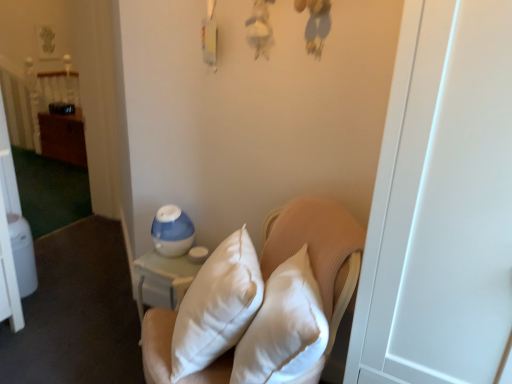
At what (x,y) coordinates should I click in order to perform the action: click on wooden dresser at left. Please return your answer as a coordinate pair (x, y). The width and height of the screenshot is (512, 384). Looking at the image, I should click on (63, 137).

Is there a large distance between wooden bed at left and white quilted pillows at center?

Yes, wooden bed at left and white quilted pillows at center are located far from each other.

Considering the points (71, 150) and (352, 307), which point is behind, point (71, 150) or point (352, 307)?

The point (71, 150) is more distant.

Which of these two, wooden bed at left or white quilted pillows at center, is bigger?

white quilted pillows at center.

From the image's perspective, is wooden bed at left located beneath white quilted pillows at center?

No, from the image's perspective, wooden bed at left is not beneath white quilted pillows at center.

Locate an element on the screen. Image resolution: width=512 pixels, height=384 pixels. bed behind the white quilted pillows at center is located at coordinates (55, 114).

Is white quilted pillows at center facing away from wooden bed at left?

No, white quilted pillows at center's orientation is not away from wooden bed at left.

Is white quilted pillows at center not close to wooden bed at left?

white quilted pillows at center is far away from wooden bed at left.

What are the coordinates of `dresser lying behind the white quilted pillows at center` in the screenshot? It's located at (63, 137).

From the image's perspective, is white quilted pillows at center on top of wooden dresser at left?

No, from the image's perspective, white quilted pillows at center is not on top of wooden dresser at left.

Does white quilted pillows at center have a lesser width compared to wooden dresser at left?

No.

Is white quilted pillows at center facing towards wooden dresser at left?

No, white quilted pillows at center does not turn towards wooden dresser at left.

From a real-world perspective, is wooden dresser at left above or below white quilted pillows at center?

In terms of real-world spatial position, wooden dresser at left is below white quilted pillows at center.

Is point (53, 130) closer or farther from the camera than point (281, 252)?

Point (53, 130) appears to be farther away from the viewer than point (281, 252).

How many degrees apart are the facing directions of wooden dresser at left and white quilted pillows at center?

31.2 degrees.

Is wooden dresser at left in front of white quilted pillows at center?

No, wooden dresser at left is further to the viewer.

Is point (80, 160) closer to camera compared to point (55, 150)?

Yes.

Which object is positioned more to the right, wooden dresser at left or wooden bed at left?

From the viewer's perspective, wooden dresser at left appears more on the right side.

Considering the sizes of objects wooden dresser at left and wooden bed at left in the image provided, who is bigger, wooden dresser at left or wooden bed at left?

Bigger between the two is wooden dresser at left.

Based on the photo, can you confirm if wooden dresser at left is thinner than wooden bed at left?

In fact, wooden dresser at left might be wider than wooden bed at left.

From the picture: Is wooden bed at left outside of wooden dresser at left?

That's correct, wooden bed at left is outside of wooden dresser at left.

Who is shorter, wooden bed at left or wooden dresser at left?

Standing shorter between the two is wooden dresser at left.

Considering the sizes of objects wooden bed at left and wooden dresser at left in the image provided, who is thinner, wooden bed at left or wooden dresser at left?

Thinner between the two is wooden bed at left.

Between wooden bed at left and wooden dresser at left, which one appears on the right side from the viewer's perspective?

wooden dresser at left is more to the right.

In the image, there is a wooden bed at left. Identify the location of furniture below it (from a real-world perspective). The height and width of the screenshot is (384, 512). (317, 247).

This screenshot has height=384, width=512. Identify the location of bed above the white quilted pillows at center (from a real-world perspective). (55, 114).

Looking at the image, which one is located closer to wooden bed at left, white quilted pillows at center or wooden dresser at left?

wooden dresser at left lies closer to wooden bed at left than the other object.

Considering their positions, is wooden bed at left positioned further to white quilted pillows at center than wooden dresser at left?

Among the two, wooden bed at left is located further to white quilted pillows at center.

Looking at this image, based on their spatial positions, is wooden bed at left or white quilted pillows at center closer to wooden dresser at left?

The object closer to wooden dresser at left is wooden bed at left.

Which object lies further to the anchor point wooden dresser at left, white quilted pillows at center or wooden bed at left?

white quilted pillows at center lies further to wooden dresser at left than the other object.

Looking at the image, which one is located closer to white quilted pillows at center, wooden dresser at left or wooden bed at left?

The object closer to white quilted pillows at center is wooden dresser at left.

From the image, which object appears to be nearer to wooden bed at left, wooden dresser at left or white quilted pillows at center?

wooden dresser at left is closer to wooden bed at left.

This screenshot has width=512, height=384. I want to click on dresser between white quilted pillows at center and wooden bed at left in the front-back direction, so click(x=63, y=137).